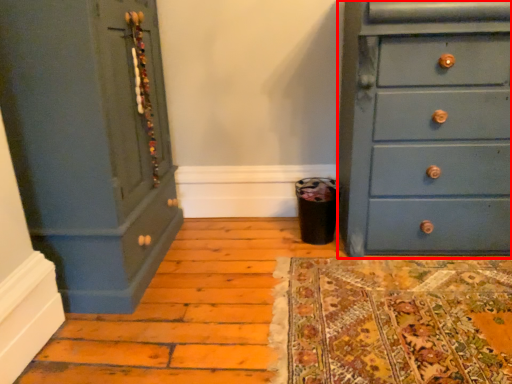
Question: Observing the image, what is the correct spatial positioning of chest of drawers (annotated by the red box) in reference to chest of drawers?

Choices:
 (A) left
 (B) right

Answer: (B)